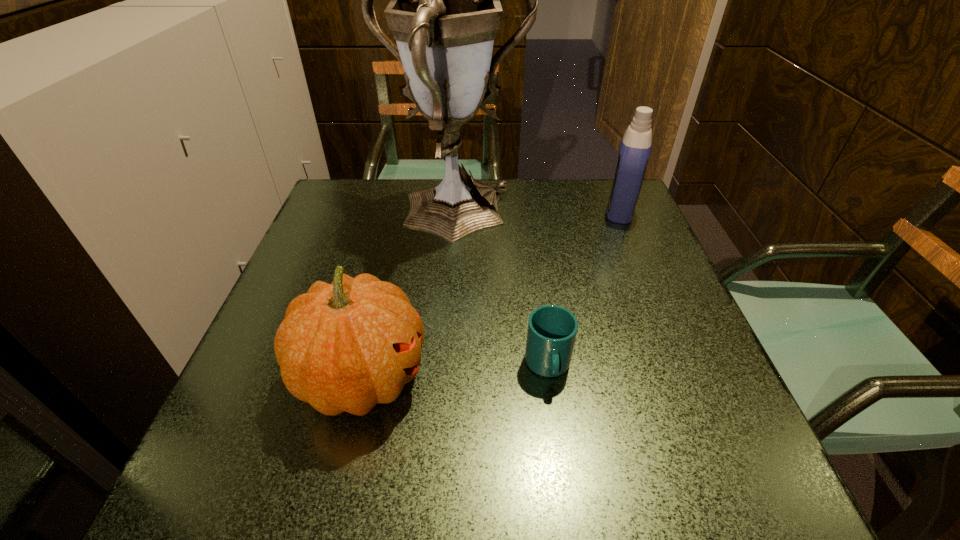
The height and width of the screenshot is (540, 960). Identify the location of trophy cup at the left edge. (446, 2).

The width and height of the screenshot is (960, 540). What are the coordinates of `pumpkin located at the left edge` in the screenshot? It's located at (346, 346).

At what (x,y) coordinates should I click in order to perform the action: click on object at the right edge. Please return your answer as a coordinate pair (x, y). The width and height of the screenshot is (960, 540). Looking at the image, I should click on (635, 148).

Locate an element on the screen. Image resolution: width=960 pixels, height=540 pixels. object located at the far left corner is located at coordinates (446, 2).

The width and height of the screenshot is (960, 540). I want to click on object at the far right corner, so click(635, 148).

What are the coordinates of `free space at the far edge of the desktop` in the screenshot? It's located at (408, 190).

Image resolution: width=960 pixels, height=540 pixels. What are the coordinates of `vacant area at the near edge of the desktop` in the screenshot? It's located at coord(553,471).

In the image, there is a desktop. Identify the location of free space at the left edge. This screenshot has height=540, width=960. (348, 252).

In the image, there is a desktop. What are the coordinates of `free space at the right edge` in the screenshot? It's located at (633, 305).

Locate an element on the screen. vacant space at the far left corner of the desktop is located at coordinates (327, 193).